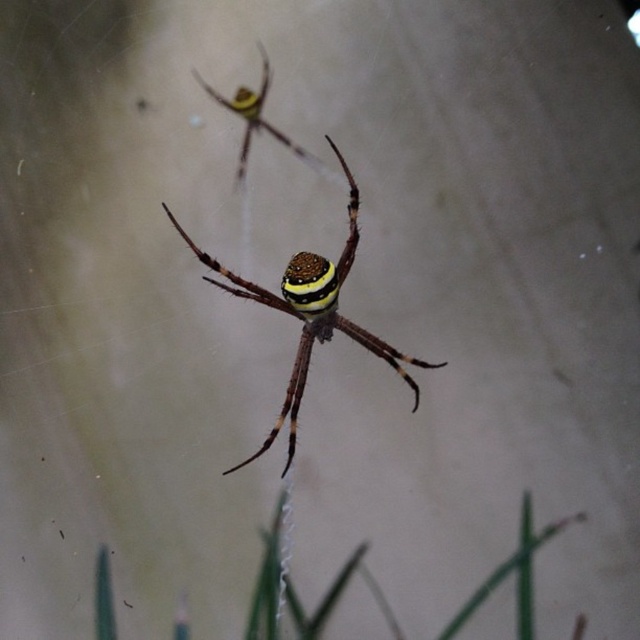
Question: Does green grass at bottom come in front of yellow striped spider at upper center?

Choices:
 (A) yes
 (B) no

Answer: (A)

Question: Which object is the closest to the yellow striped spider at upper center?

Choices:
 (A) yellow striped spider at center
 (B) green grass at bottom

Answer: (A)

Question: Can you confirm if green grass at bottom is wider than yellow striped spider at upper center?

Choices:
 (A) yes
 (B) no

Answer: (B)

Question: Is yellow striped spider at center to the right of yellow striped spider at upper center from the viewer's perspective?

Choices:
 (A) no
 (B) yes

Answer: (B)

Question: Which object appears farthest from the camera in this image?

Choices:
 (A) yellow striped spider at center
 (B) yellow striped spider at upper center

Answer: (B)

Question: Which of the following is the farthest from the observer?

Choices:
 (A) green grass at bottom
 (B) yellow striped spider at center
 (C) yellow striped spider at upper center

Answer: (C)